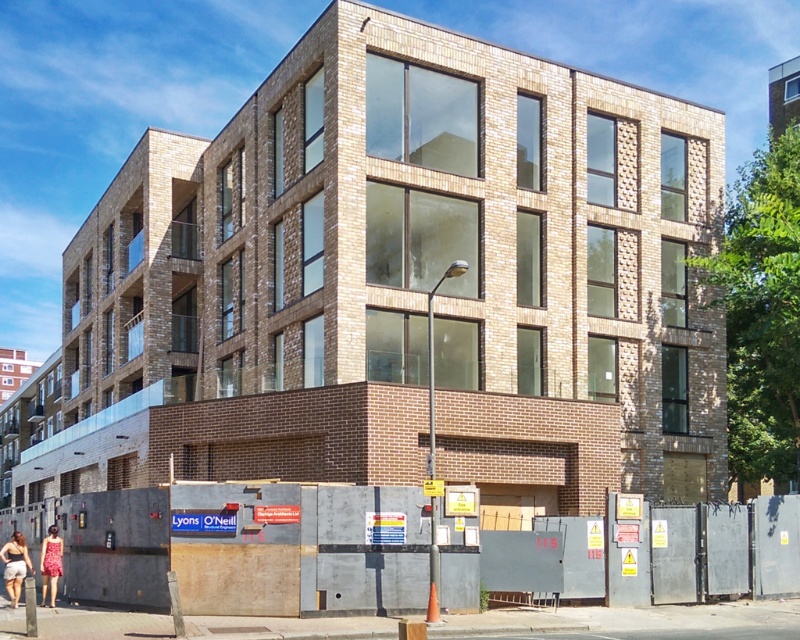
Can you confirm if light pink cotton dress at lower left is positioned below floral dress at lower left?

Indeed, light pink cotton dress at lower left is positioned under floral dress at lower left.

Who is more distant from viewer, (5, 564) or (52, 577)?

Positioned behind is point (52, 577).

Between point (16, 588) and point (60, 573), which one is positioned in front?

Point (16, 588)

Locate an element on the screen. light pink cotton dress at lower left is located at coordinates (14, 564).